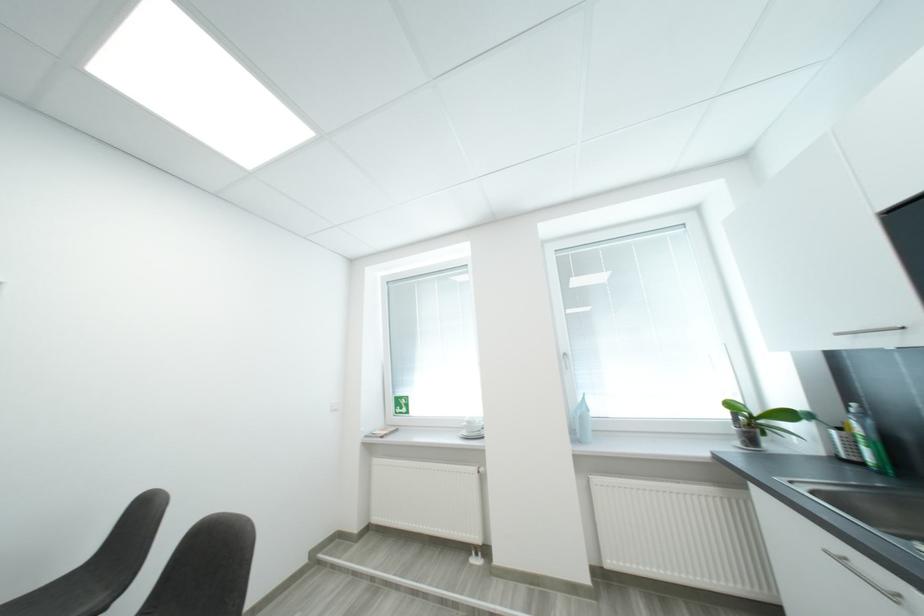
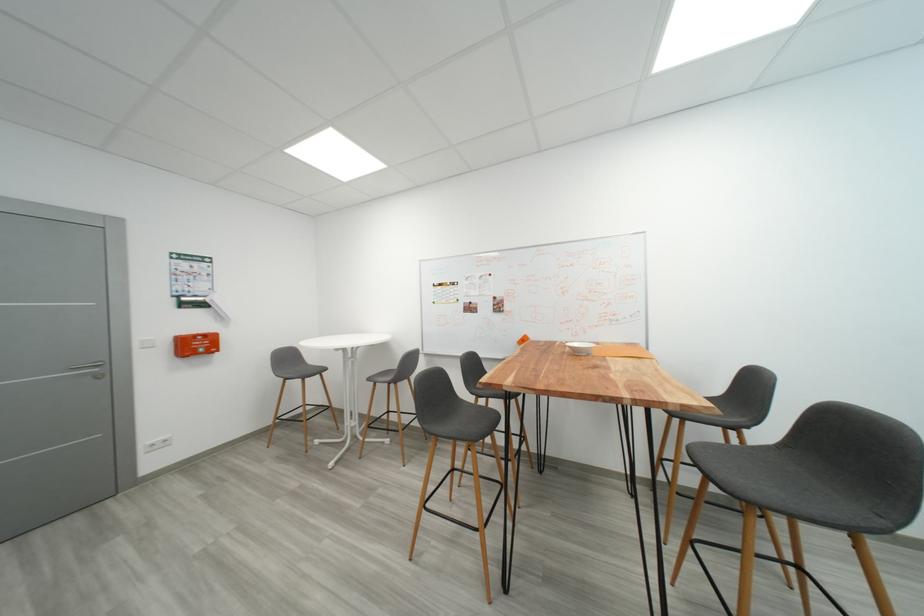
Where in the second image is the point corresponding to point 151,515 from the first image?

(761, 381)